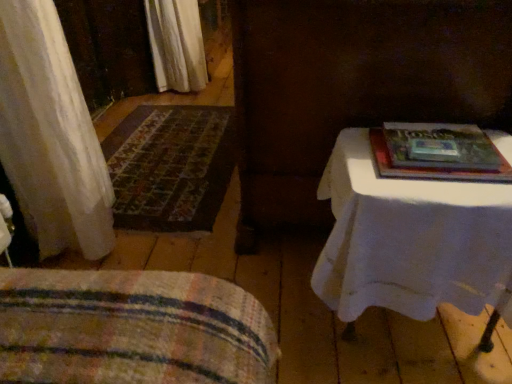
What do you see at coordinates (131, 329) in the screenshot? I see `striped fabric blanket at lower left` at bounding box center [131, 329].

The height and width of the screenshot is (384, 512). In order to click on carpeted mat at left in this screenshot , I will do `click(170, 166)`.

Identify the location of hardcover book at upper right. (431, 168).

Do you think hardcover book at upper right is within striped fabric blanket at lower left, or outside of it?

hardcover book at upper right lies outside striped fabric blanket at lower left.

From a real-world perspective, who is located lower, hardcover book at upper right or striped fabric blanket at lower left?

striped fabric blanket at lower left.

Is hardcover book at upper right far from striped fabric blanket at lower left?

No, hardcover book at upper right is not far away from striped fabric blanket at lower left.

Which of these two, hardcover book at upper right or striped fabric blanket at lower left, stands shorter?

hardcover book at upper right is shorter.

Is point (478, 179) closer or farther from the camera than point (155, 150)?

Point (478, 179) is positioned closer to the camera compared to point (155, 150).

What's the angular difference between hardcover book at upper right and carpeted mat at left's facing directions?

0.345 degrees.

Considering the sizes of objects hardcover book at upper right and carpeted mat at left in the image provided, who is smaller, hardcover book at upper right or carpeted mat at left?

hardcover book at upper right.

Is hardcover book at upper right at the right side of carpeted mat at left?

Indeed, hardcover book at upper right is positioned on the right side of carpeted mat at left.

Could you tell me if carpeted mat at left is facing striped fabric blanket at lower left?

No, carpeted mat at left is not facing towards striped fabric blanket at lower left.

Which of these two, carpeted mat at left or striped fabric blanket at lower left, is thinner?

With smaller width is striped fabric blanket at lower left.

From the image's perspective, which one is positioned higher, carpeted mat at left or striped fabric blanket at lower left?

carpeted mat at left is shown above in the image.

Locate an element on the screen. mat behind the striped fabric blanket at lower left is located at coordinates (170, 166).

How different are the orientations of white cloth-covered table at right and carpeted mat at left in degrees?

1.03 degrees.

Looking at the image, does white cloth-covered table at right seem bigger or smaller compared to carpeted mat at left?

Considering their sizes, white cloth-covered table at right takes up more space than carpeted mat at left.

Does point (365, 166) lie in front of point (122, 147)?

Yes, point (365, 166) is in front of point (122, 147).

From the picture: From a real-world perspective, between white cloth-covered table at right and carpeted mat at left, who is vertically lower?

From a 3D spatial view, carpeted mat at left is below.

Is hardcover book at upper right positioned beyond the bounds of white cloth-covered table at right?

Yes, hardcover book at upper right is outside of white cloth-covered table at right.

From the image's perspective, which one is positioned higher, hardcover book at upper right or white cloth-covered table at right?

hardcover book at upper right.

Considering the relative positions of hardcover book at upper right and white cloth-covered table at right in the image provided, is hardcover book at upper right in front of white cloth-covered table at right?

No, it is not.

From a real-world perspective, is hardcover book at upper right under white cloth-covered table at right?

No, from a real-world perspective, hardcover book at upper right is not below white cloth-covered table at right.

Is hardcover book at upper right surrounded by striped fabric blanket at lower left?

No, hardcover book at upper right is not surrounded by striped fabric blanket at lower left.

Is striped fabric blanket at lower left placed right next to hardcover book at upper right?

They are not placed beside each other.

Which is in front, point (184, 330) or point (503, 181)?

The point (184, 330) is closer.

Who is taller, striped fabric blanket at lower left or hardcover book at upper right?

striped fabric blanket at lower left is taller.

Between striped fabric blanket at lower left and carpeted mat at left, which one is positioned in front?

Positioned in front is striped fabric blanket at lower left.

Which of these two, striped fabric blanket at lower left or carpeted mat at left, stands shorter?

carpeted mat at left.

Can carpeted mat at left be found inside striped fabric blanket at lower left?

Definitely not — carpeted mat at left is not inside striped fabric blanket at lower left.

In the image, there is a striped fabric blanket at lower left. Identify the location of paperback book above it (from the image's perspective). The width and height of the screenshot is (512, 384). (431, 168).

Locate an element on the screen. The image size is (512, 384). paperback book positioned vertically above the carpeted mat at left (from a real-world perspective) is located at coordinates (431, 168).

When comparing their distances from striped fabric blanket at lower left, does hardcover book at upper right or carpeted mat at left seem closer?

hardcover book at upper right is closer to striped fabric blanket at lower left.

Looking at the image, which one is located closer to striped fabric blanket at lower left, carpeted mat at left or hardcover book at upper right?

hardcover book at upper right is positioned closer to the anchor striped fabric blanket at lower left.

Looking at the image, which one is located closer to white cloth-covered table at right, hardcover book at upper right or striped fabric blanket at lower left?

Based on the image, hardcover book at upper right appears to be nearer to white cloth-covered table at right.

Based on their spatial positions, is hardcover book at upper right or white cloth-covered table at right closer to striped fabric blanket at lower left?

Based on the image, white cloth-covered table at right appears to be nearer to striped fabric blanket at lower left.

Based on the photo, considering their positions, is hardcover book at upper right positioned further to carpeted mat at left than white cloth-covered table at right?

Among the two, hardcover book at upper right is located further to carpeted mat at left.

From the image, which object appears to be nearer to hardcover book at upper right, striped fabric blanket at lower left or white cloth-covered table at right?

white cloth-covered table at right is positioned closer to the anchor hardcover book at upper right.

Estimate the real-world distances between objects in this image. Which object is further from carpeted mat at left, striped fabric blanket at lower left or hardcover book at upper right?

hardcover book at upper right is further to carpeted mat at left.

Considering their positions, is hardcover book at upper right positioned further to carpeted mat at left than striped fabric blanket at lower left?

hardcover book at upper right is positioned further to the anchor carpeted mat at left.

At what (x,y) coordinates should I click in order to perform the action: click on paperback book located between striped fabric blanket at lower left and carpeted mat at left in the depth direction. Please return your answer as a coordinate pair (x, y). This screenshot has width=512, height=384. Looking at the image, I should click on (431, 168).

Where is `paperback book situated between carpeted mat at left and white cloth-covered table at right from left to right`? The image size is (512, 384). paperback book situated between carpeted mat at left and white cloth-covered table at right from left to right is located at coordinates (431, 168).

The height and width of the screenshot is (384, 512). I want to click on paperback book between striped fabric blanket at lower left and white cloth-covered table at right from left to right, so click(x=431, y=168).

Where is `table positioned between striped fabric blanket at lower left and carpeted mat at left from near to far`? This screenshot has width=512, height=384. table positioned between striped fabric blanket at lower left and carpeted mat at left from near to far is located at coordinates (409, 239).